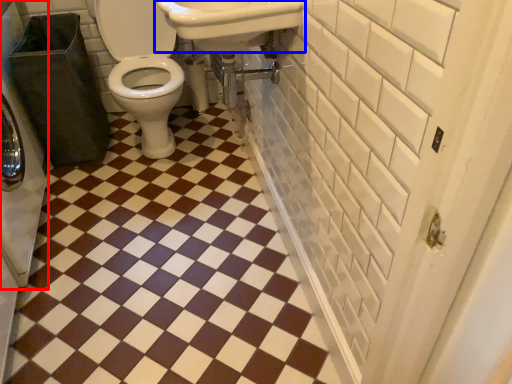
Question: Which object is further to the camera taking this photo, washer (highlighted by a red box) or sink (highlighted by a blue box)?

Choices:
 (A) washer
 (B) sink

Answer: (A)